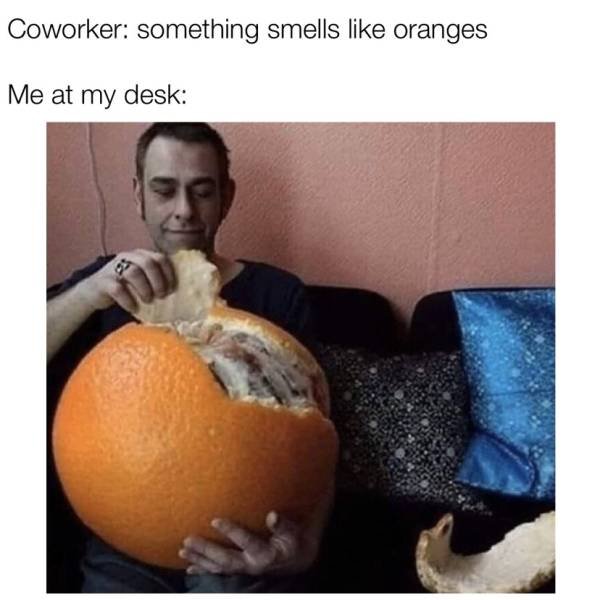
Identify the location of wall. (315, 186).